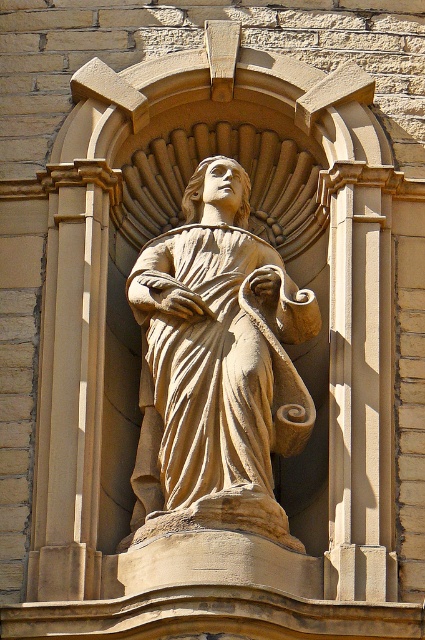
You are an architect assessing the proportions of the facade. The beige stone statue at center and the beige stone column at left are both part of the design. Which one is shorter?

The beige stone statue at center is shorter than the beige stone column at left.

You are standing in front of the stone sculpture and want to touch both points mentioned. Which point should you reach for first, the point at coordinates point (x=186, y=416) or point (x=78, y=484)?

You should reach for point (x=186, y=416) first because it is closer to you than point (x=78, y=484), which is further away.